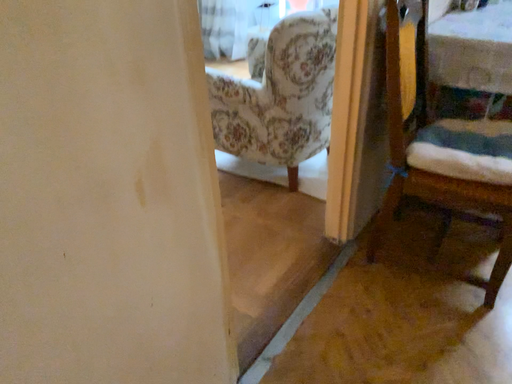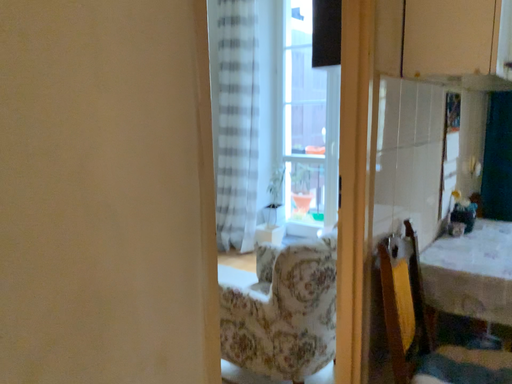
Question: How did the camera likely rotate when shooting the video?

Choices:
 (A) rotated downward
 (B) rotated upward

Answer: (B)